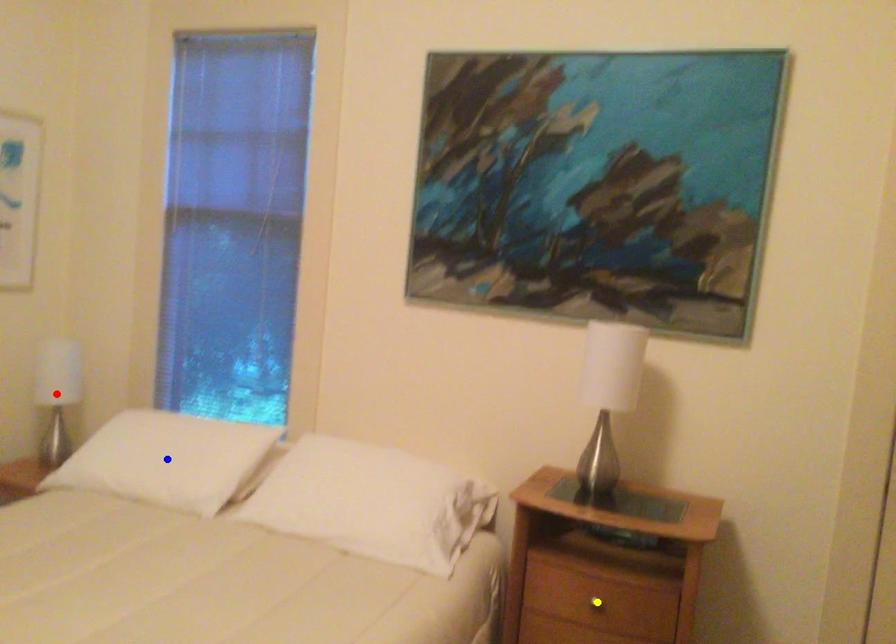
Order these from nearest to farthest:
A) yellow point
B) blue point
C) red point

A: yellow point, blue point, red point